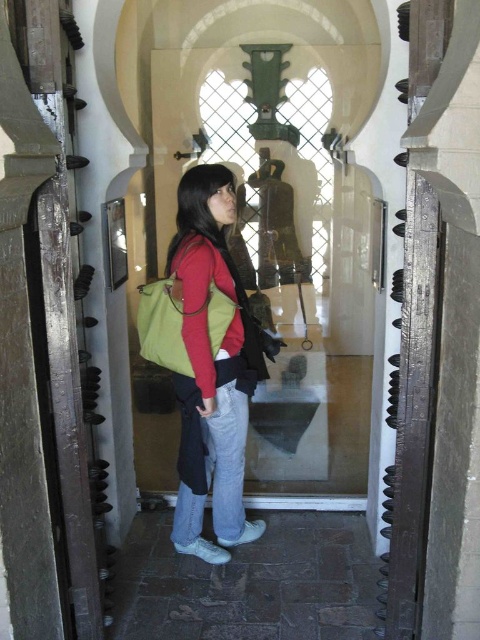
Question: Is matte green bag at center thinner than green fabric bag at center?

Choices:
 (A) yes
 (B) no

Answer: (A)

Question: Which object is farther from the camera taking this photo?

Choices:
 (A) green fabric bag at center
 (B) matte green bag at center

Answer: (B)

Question: Can you confirm if matte green bag at center is positioned below green fabric bag at center?

Choices:
 (A) yes
 (B) no

Answer: (A)

Question: Which object is closer to the camera taking this photo?

Choices:
 (A) matte green bag at center
 (B) green fabric bag at center

Answer: (B)

Question: Is matte green bag at center closer to camera compared to green fabric bag at center?

Choices:
 (A) yes
 (B) no

Answer: (B)